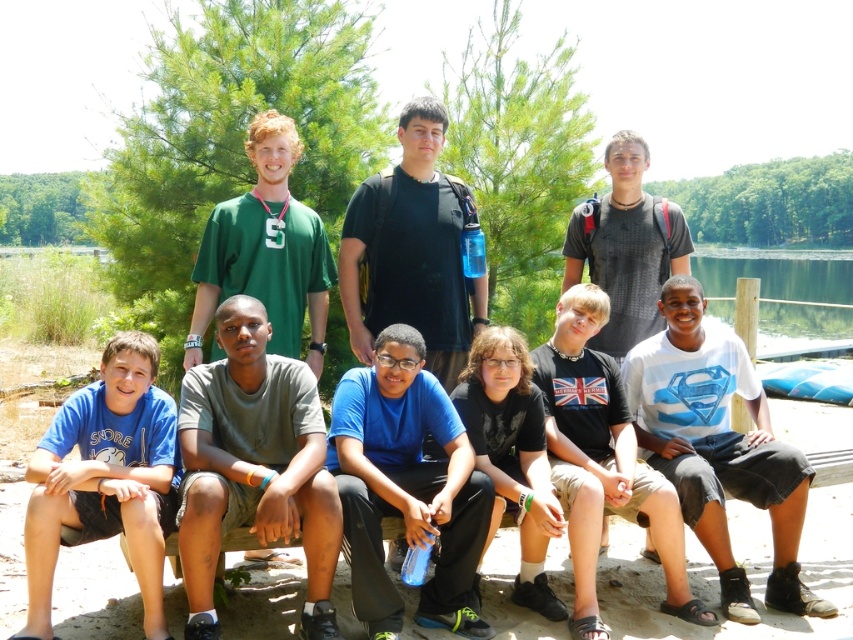
Looking at this image, you are trying to decide which shirt to choose for a hiking trip. You want the one that is taller. Which one should you pick between the blue cotton shirt at center and the white cotton shirt at lower right?

The white cotton shirt at lower right is taller than the blue cotton shirt at center, so you should choose the white cotton shirt at lower right.

You are organizing a group photo and need to arrange two people based on their shirt sizes. The blue cotton shirt at center and the black matte shirt at center are available. Which shirt should you place on the left if you want the larger shirt to be on the right?

The black matte shirt at center is larger than the blue cotton shirt at center, so you should place the black matte shirt at center on the right and the blue cotton shirt at center on the left.

You are standing at the campsite and want to take a photo of the group. You notice two points marked in the scene. Which point, point 1 at coordinates (x=683, y=368) or point 2 at (x=340, y=248), is closer to your camera lens?

Point 1 at coordinates (x=683, y=368) is closer to the camera lens than point 2 at (x=340, y=248).